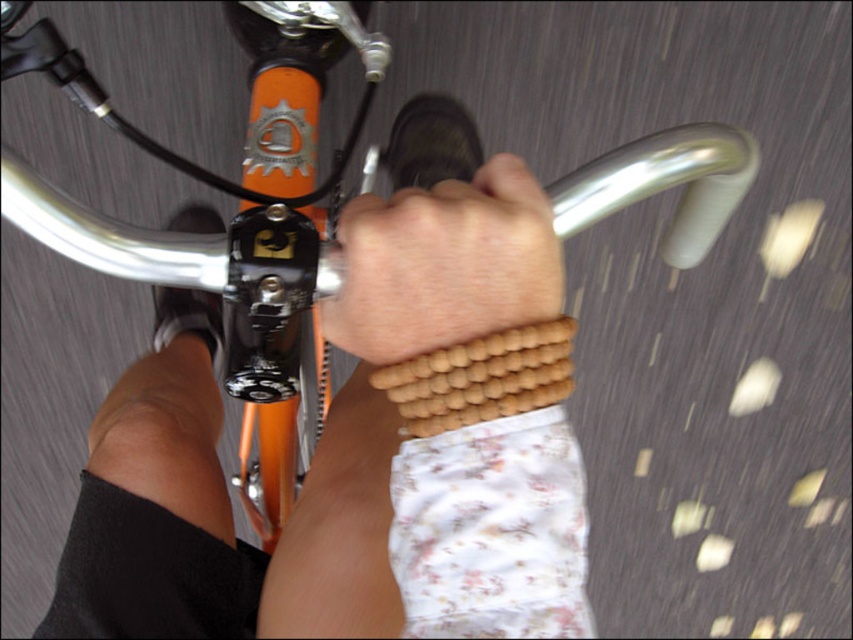
Question: Which object appears closest to the camera in this image?

Choices:
 (A) brown wooden beads at center
 (B) wooden beads at center

Answer: (B)

Question: Can you confirm if wooden beads at center is wider than brown wooden beads at center?

Choices:
 (A) no
 (B) yes

Answer: (B)

Question: Can you confirm if wooden beads at center is smaller than brown wooden beads at center?

Choices:
 (A) no
 (B) yes

Answer: (A)

Question: Can you confirm if wooden beads at center is positioned below brown wooden beads at center?

Choices:
 (A) no
 (B) yes

Answer: (B)

Question: Which point is farther to the camera?

Choices:
 (A) (367, 209)
 (B) (379, 356)

Answer: (A)

Question: Which point appears farthest from the camera in this image?

Choices:
 (A) (436, 385)
 (B) (370, 276)

Answer: (B)